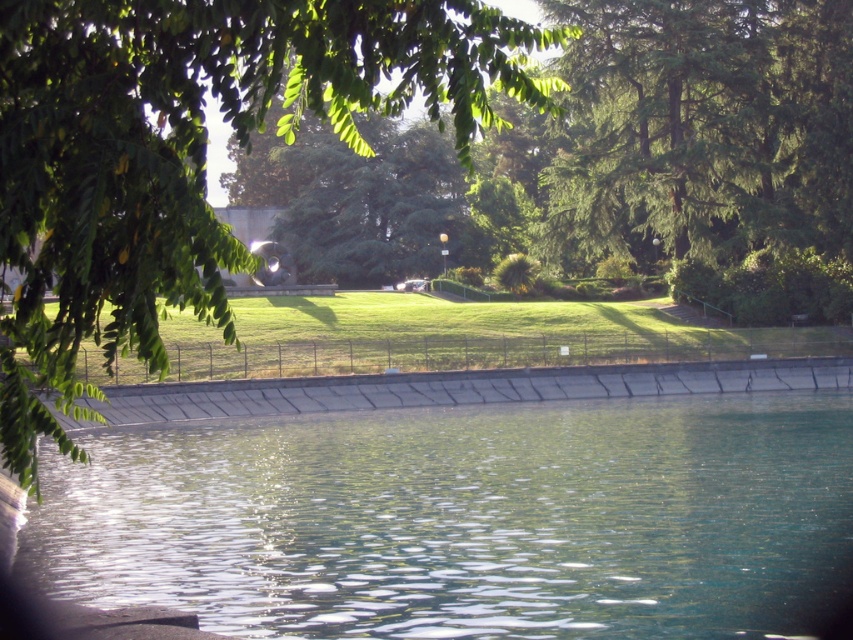
You are standing on the green grass at center and want to look at the green leafy tree at upper left. Which direction should you turn your head to see it?

The green leafy tree at upper left is above the green grass at center, so you should look upward to see it.

You are a gardener who wants to plant a new flower bed between the clear glass water at lower center and the green grass at center. Which area has more space to accommodate the flowers?

The green grass at center has more space because the clear glass water at lower center is thinner, meaning it occupies less area than the green grass at center.